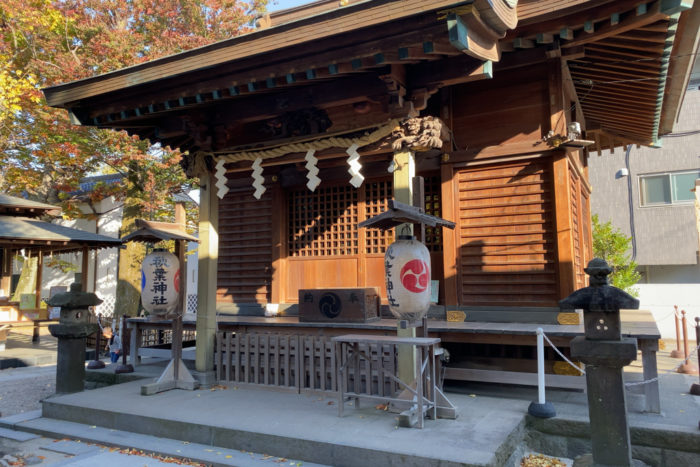
You are a GUI agent. You are given a task and a screenshot of the screen. Output one action in this format:
    pyautogui.click(x=<x>, y=<y>)
    Task: Click on the lanterns
    The image size is (700, 467).
    Given the screenshot: What is the action you would take?
    point(160,284), point(409,281)